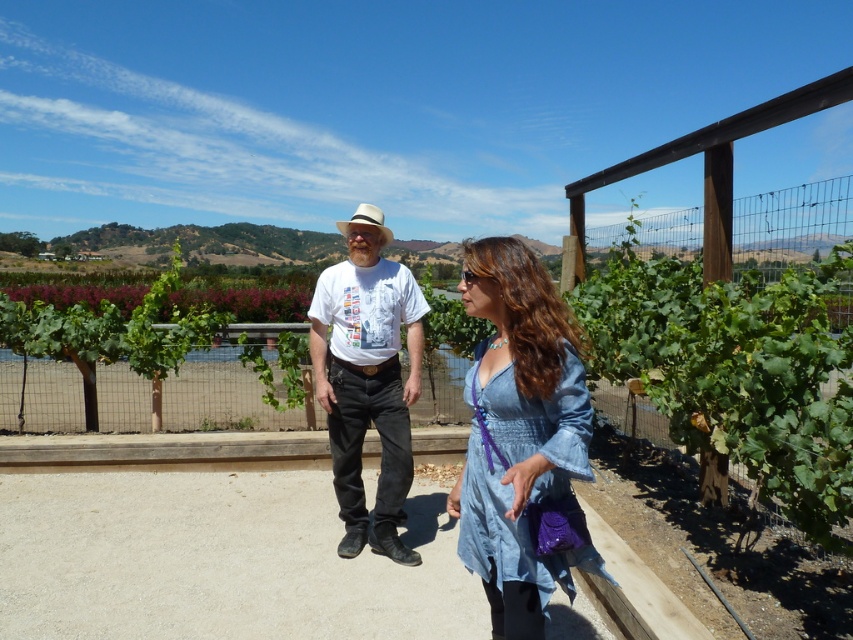
Is light gray concrete at center to the right of white cotton shirt at center from the viewer's perspective?

Incorrect, light gray concrete at center is not on the right side of white cotton shirt at center.

This screenshot has width=853, height=640. What are the coordinates of `light gray concrete at center` in the screenshot? It's located at (219, 560).

Based on the photo, does denim dress at center have a greater width compared to white cotton shirt at center?

No, denim dress at center is not wider than white cotton shirt at center.

Between point (531, 486) and point (392, 403), which one is positioned in front?

Positioned in front is point (531, 486).

Who is more forward, (476, 403) or (415, 365)?

Point (476, 403) is in front.

Locate an element on the screen. The height and width of the screenshot is (640, 853). denim dress at center is located at coordinates (519, 433).

From the picture: Between light gray concrete at center and denim dress at center, which one has more height?

denim dress at center is taller.

Is light gray concrete at center thinner than denim dress at center?

No.

Locate an element on the screen. Image resolution: width=853 pixels, height=640 pixels. light gray concrete at center is located at coordinates (219, 560).